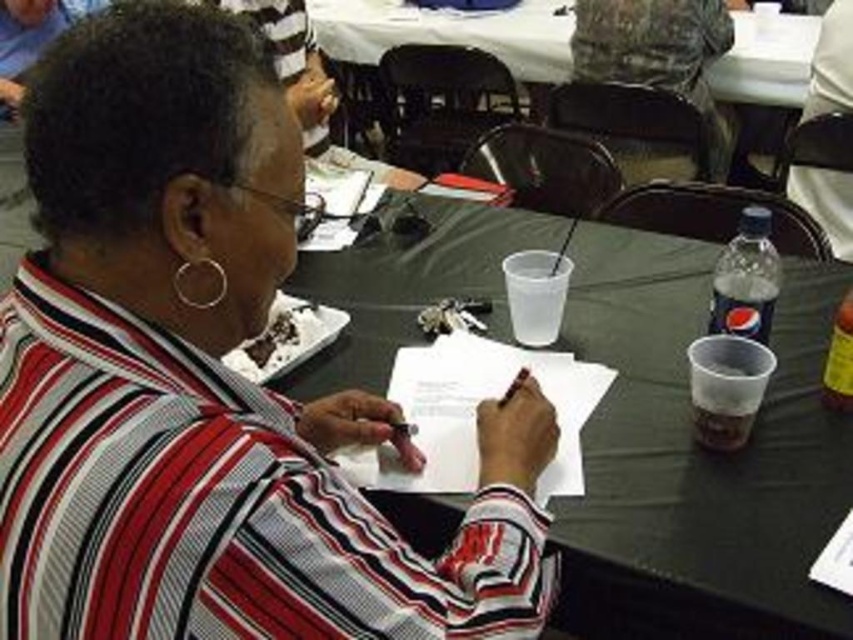
Question: Can you confirm if striped fabric shirt at center is smaller than black plastic table at center?

Choices:
 (A) no
 (B) yes

Answer: (B)

Question: Among these points, which one is nearest to the camera?

Choices:
 (A) (321, 528)
 (B) (805, 285)

Answer: (A)

Question: Is striped fabric shirt at center below black plastic table at center?

Choices:
 (A) no
 (B) yes

Answer: (B)

Question: Can you confirm if striped fabric shirt at center is wider than black plastic table at center?

Choices:
 (A) yes
 (B) no

Answer: (B)

Question: Which point is closer to the camera?

Choices:
 (A) (634, 275)
 (B) (86, 435)

Answer: (B)